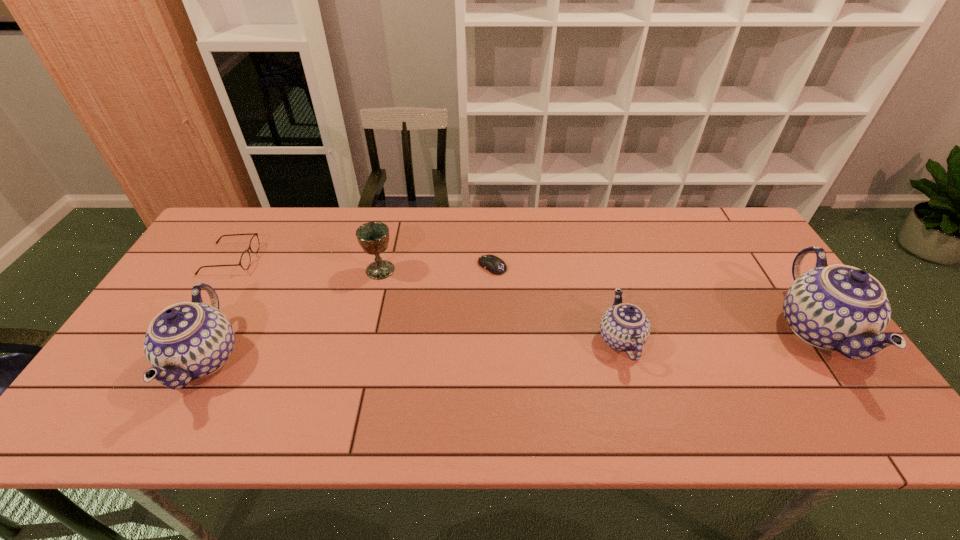
Find the location of a particular element. This screenshot has width=960, height=540. chinaware that is at the left edge is located at coordinates (188, 340).

At what (x,y) coordinates should I click in order to perform the action: click on spectacles that is at the left edge. Please return your answer as a coordinate pair (x, y). Looking at the image, I should click on (245, 260).

Where is `object that is at the right edge`? Image resolution: width=960 pixels, height=540 pixels. object that is at the right edge is located at coordinates (838, 307).

You are a GUI agent. You are given a task and a screenshot of the screen. Output one action in this format:
    pyautogui.click(x=<x>, y=<y>)
    Task: Click on the object situated at the far left corner
    
    Given the screenshot: What is the action you would take?
    pyautogui.click(x=245, y=260)

Find the location of a particular element. object present at the near left corner is located at coordinates 188,340.

You are a GUI agent. You are given a task and a screenshot of the screen. Output one action in this format:
    pyautogui.click(x=<x>, y=<y>)
    Task: Click on the object present at the near right corner
    Image resolution: width=960 pixels, height=540 pixels.
    Given the screenshot: What is the action you would take?
    pyautogui.click(x=838, y=307)

The height and width of the screenshot is (540, 960). In the image, there is a desktop. Identify the location of free space at the far edge. (540, 235).

In the image, there is a desktop. Identify the location of vacant space at the near edge. The width and height of the screenshot is (960, 540). (513, 379).

At what (x,y) coordinates should I click in order to perform the action: click on vacant area at the right edge. Please return your answer as a coordinate pair (x, y). Looking at the image, I should click on (x=762, y=288).

What are the coordinates of `vacant position at the far left corner of the desktop` in the screenshot? It's located at tap(231, 208).